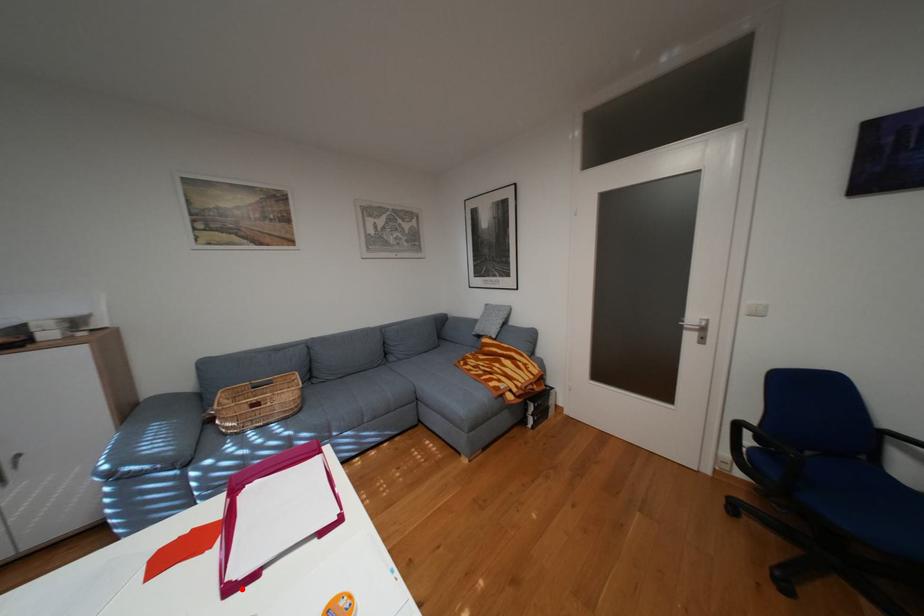
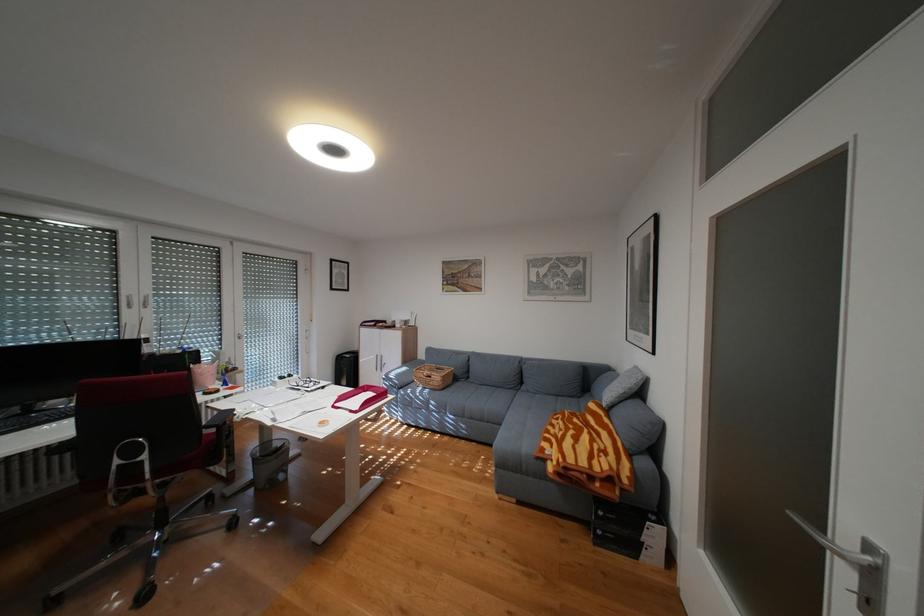
Where in the second image is the point corresponding to the highlighted location from the first image?

(346, 406)